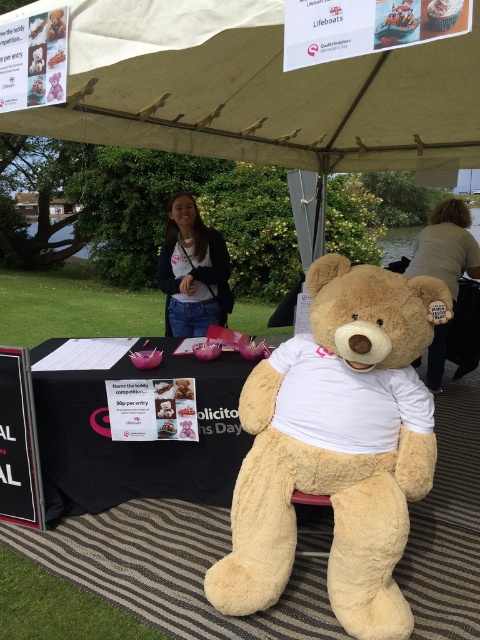
Question: Which point appears closest to the camera in this image?

Choices:
 (A) (460, 275)
 (B) (214, 266)
 (C) (121, 376)
 (D) (303, 120)

Answer: (C)

Question: Which of the following is the farthest from the observer?

Choices:
 (A) light brown hair at upper right
 (B) black fabric table at center
 (C) white fabric canopy at upper center
 (D) fluffy beige teddy bear at center

Answer: (A)

Question: Is black fabric table at center to the right of light brown hair at upper right from the viewer's perspective?

Choices:
 (A) no
 (B) yes

Answer: (A)

Question: Is white fabric canopy at upper center positioned before fluffy beige teddy bear at center?

Choices:
 (A) yes
 (B) no

Answer: (A)

Question: Considering the real-world distances, which object is farthest from the matte white shirt at center?

Choices:
 (A) white fabric canopy at upper center
 (B) black fabric table at center
 (C) fluffy beige teddy bear at center

Answer: (C)

Question: Does black fabric table at center appear on the right side of matte white shirt at center?

Choices:
 (A) yes
 (B) no

Answer: (B)